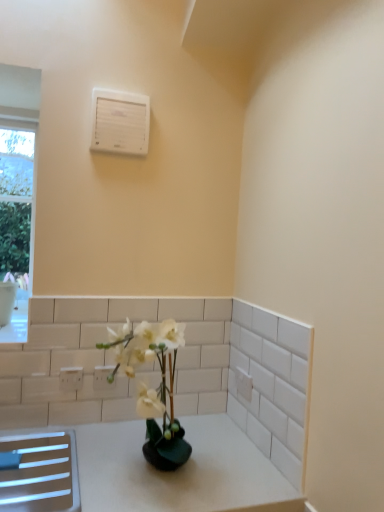
Question: Is white plastic electric outlet at lower left, which ranks as the 1th electric outlet in left-to-right order, thinner than white plastic air conditioning unit at upper center?

Choices:
 (A) no
 (B) yes

Answer: (B)

Question: Considering the relative positions of white plastic electric outlet at lower left, the second electric outlet positioned from the back, and white plastic air conditioning unit at upper center in the image provided, is white plastic electric outlet at lower left, the second electric outlet positioned from the back, to the left of white plastic air conditioning unit at upper center from the viewer's perspective?

Choices:
 (A) yes
 (B) no

Answer: (A)

Question: From a real-world perspective, does white plastic electric outlet at lower left, which is the first electric outlet from front to back, stand above white plastic air conditioning unit at upper center?

Choices:
 (A) yes
 (B) no

Answer: (B)

Question: Is white plastic electric outlet at lower left, which is the first electric outlet from front to back, not inside white plastic air conditioning unit at upper center?

Choices:
 (A) yes
 (B) no

Answer: (A)

Question: From the image's perspective, does white plastic electric outlet at lower left, which ranks as the 1th electric outlet in left-to-right order, appear lower than white plastic air conditioning unit at upper center?

Choices:
 (A) no
 (B) yes

Answer: (B)

Question: Based on their sizes in the image, would you say white glossy vase at center is bigger or smaller than white plastic electric outlet at lower left, which is the 1th electric outlet from back to front?

Choices:
 (A) small
 (B) big

Answer: (B)

Question: From their relative heights in the image, would you say white glossy vase at center is taller or shorter than white plastic electric outlet at lower left, the second electric outlet in the front-to-back sequence?

Choices:
 (A) tall
 (B) short

Answer: (A)

Question: Is white glossy vase at center in front of or behind white plastic electric outlet at lower left, the second electric outlet in the front-to-back sequence, in the image?

Choices:
 (A) behind
 (B) front

Answer: (B)

Question: Does point (109, 338) appear closer or farther from the camera than point (109, 384)?

Choices:
 (A) farther
 (B) closer

Answer: (B)

Question: Relative to white glossy vase at center, is white plastic electric outlet at lower left, the second electric outlet positioned from the back, in front or behind?

Choices:
 (A) behind
 (B) front

Answer: (A)

Question: From the image's perspective, relative to white glossy vase at center, is white plastic electric outlet at lower left, the second electric outlet positioned from the back, above or below?

Choices:
 (A) below
 (B) above

Answer: (A)

Question: Based on their sizes in the image, would you say white plastic electric outlet at lower left, which ranks as the 1th electric outlet in left-to-right order, is bigger or smaller than white glossy vase at center?

Choices:
 (A) small
 (B) big

Answer: (A)

Question: From a real-world perspective, is white plastic electric outlet at lower left, the second electric outlet positioned from the back, positioned above or below white glossy vase at center?

Choices:
 (A) below
 (B) above

Answer: (A)

Question: In terms of height, does white plastic electric outlet at lower left, which ranks as the 1th electric outlet in left-to-right order, look taller or shorter compared to white plastic electric outlet at lower left, arranged as the 1th electric outlet when viewed from the right?

Choices:
 (A) short
 (B) tall

Answer: (A)

Question: Looking at the image, does white plastic electric outlet at lower left, the second electric outlet in the right-to-left sequence, seem bigger or smaller compared to white plastic electric outlet at lower left, which is the 1th electric outlet from back to front?

Choices:
 (A) small
 (B) big

Answer: (A)